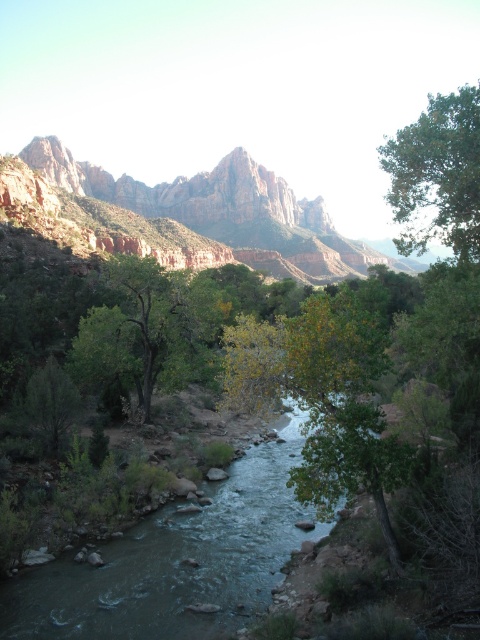
Does green smooth stream at center appear under rustic rock formation at upper center?

Yes.

Which of these two, green smooth stream at center or rustic rock formation at upper center, stands shorter?

With less height is green smooth stream at center.

Between point (250, 560) and point (39, 152), which one is positioned behind?

The point (39, 152) is behind.

Where is `green smooth stream at center`? The height and width of the screenshot is (640, 480). green smooth stream at center is located at coordinates (177, 561).

Is green leafy tree at center positioned at the back of green leafy tree at upper right?

Yes, it is behind green leafy tree at upper right.

What do you see at coordinates (144, 332) in the screenshot? I see `green leafy tree at center` at bounding box center [144, 332].

Image resolution: width=480 pixels, height=640 pixels. I want to click on green leafy tree at center, so click(144, 332).

Between green smooth stream at center and green leafy tree at center, which one has more height?

Standing taller between the two is green leafy tree at center.

Between green smooth stream at center and green leafy tree at center, which one is positioned lower?

green smooth stream at center is lower down.

Is point (276, 560) positioned before point (122, 355)?

Yes, point (276, 560) is in front of point (122, 355).

Where is `green smooth stream at center`? green smooth stream at center is located at coordinates (177, 561).